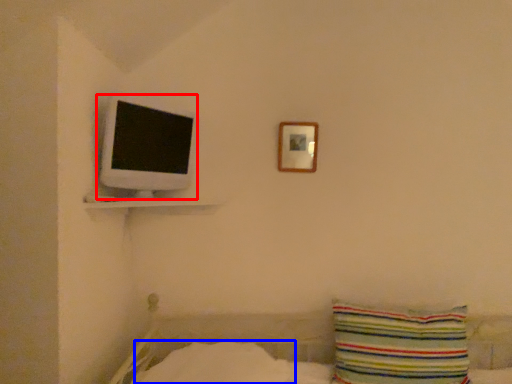
Question: Among these objects, which one is farthest to the camera, computer monitor (highlighted by a red box) or sheet (highlighted by a blue box)?

Choices:
 (A) computer monitor
 (B) sheet

Answer: (A)